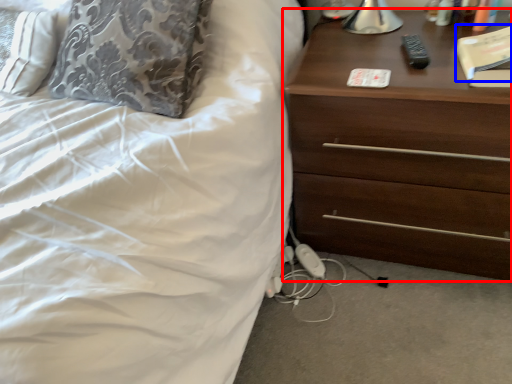
Question: Which of the following is the farthest to the observer, chest of drawers (highlighted by a red box) or book (highlighted by a blue box)?

Choices:
 (A) chest of drawers
 (B) book

Answer: (B)